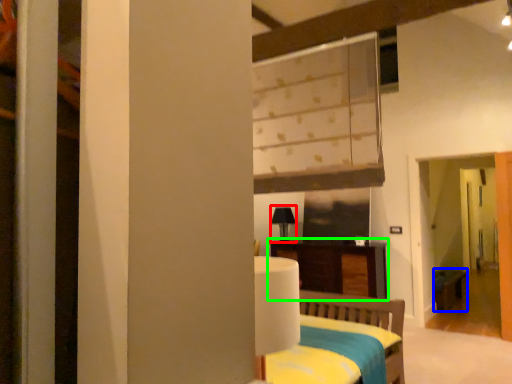
Question: Which is farther away from table lamp (highlighted by a red box)? table (highlighted by a blue box) or furniture (highlighted by a green box)?

Choices:
 (A) table
 (B) furniture

Answer: (A)